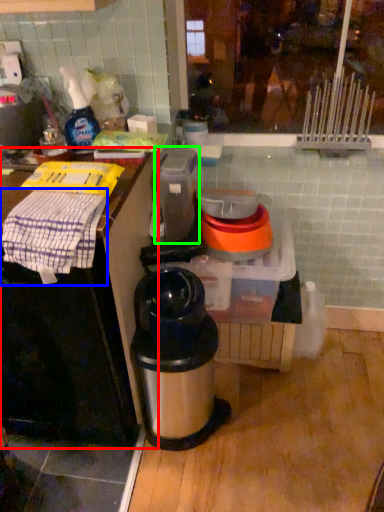
Question: Which object is the closest to the table (highlighted by a red box)? Choose among these: cloth (highlighted by a blue box) or appliance (highlighted by a green box).

Choices:
 (A) cloth
 (B) appliance

Answer: (A)